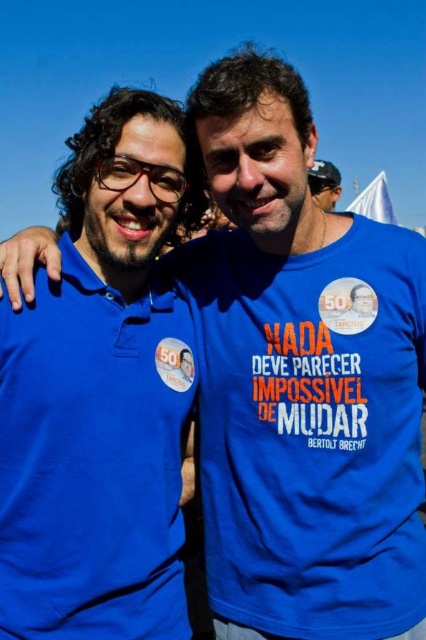
The width and height of the screenshot is (426, 640). I want to click on matte blue t-shirt at center, so click(310, 429).

Between matte blue t-shirt at center and matte blue shirt at center, which one has more height?

matte blue shirt at center is taller.

I want to click on matte blue t-shirt at center, so click(x=310, y=429).

You are a GUI agent. You are given a task and a screenshot of the screen. Output one action in this format:
    pyautogui.click(x=<x>, y=<y>)
    Task: Click on the matte blue t-shirt at center
    
    Given the screenshot: What is the action you would take?
    pyautogui.click(x=310, y=429)

How distant is matte blue t-shirt at center from matte blue polo shirt at left?

10.54 feet

Does matte blue t-shirt at center have a larger size compared to matte blue polo shirt at left?

No.

Locate an element on the screen. The height and width of the screenshot is (640, 426). matte blue t-shirt at center is located at coordinates (310, 429).

The image size is (426, 640). In order to click on matte blue polo shirt at left in this screenshot , I will do `click(92, 460)`.

Which is more to the right, matte blue polo shirt at left or matte blue shirt at center?

Positioned to the right is matte blue shirt at center.

Describe the element at coordinates (92, 460) in the screenshot. This screenshot has width=426, height=640. I see `matte blue polo shirt at left` at that location.

The width and height of the screenshot is (426, 640). I want to click on matte blue polo shirt at left, so click(92, 460).